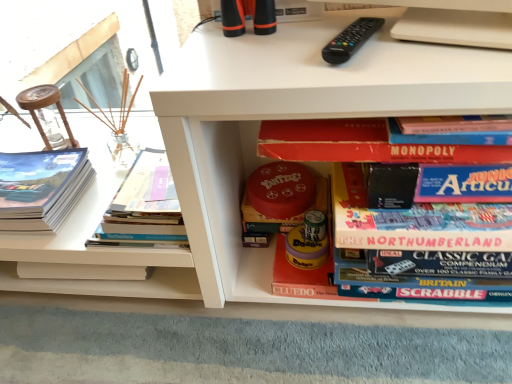
Question: From a real-world perspective, is red matte board game at center, the 4th book viewed from the left, over matte paper book at left, positioned as the 1th book in left-to-right order?

Choices:
 (A) no
 (B) yes

Answer: (B)

Question: Is red matte board game at center, which is counted as the first book, starting from the right, positioned far away from matte paper book at left, which ranks as the fourth book in right-to-left order?

Choices:
 (A) no
 (B) yes

Answer: (A)

Question: Is red matte board game at center, which is counted as the first book, starting from the right, positioned with its back to matte paper book at left, positioned as the 1th book in left-to-right order?

Choices:
 (A) no
 (B) yes

Answer: (A)

Question: Is red matte board game at center, the 4th book viewed from the left, taller than matte paper book at left, positioned as the 1th book in left-to-right order?

Choices:
 (A) yes
 (B) no

Answer: (A)

Question: Can you confirm if red matte board game at center, which is counted as the first book, starting from the right, is wider than matte paper book at left, which ranks as the fourth book in right-to-left order?

Choices:
 (A) no
 (B) yes

Answer: (B)

Question: Considering the positions of point (81, 173) and point (147, 163), is point (81, 173) closer or farther from the camera than point (147, 163)?

Choices:
 (A) closer
 (B) farther

Answer: (B)

Question: From a real-world perspective, is matte paper book at left, positioned as the 1th book in left-to-right order, above or below hardcover book at left, the 3th book in the right-to-left sequence?

Choices:
 (A) above
 (B) below

Answer: (B)

Question: From the image's perspective, relative to hardcover book at left, which appears as the second book when viewed from the left, is matte paper book at left, which ranks as the fourth book in right-to-left order, above or below?

Choices:
 (A) below
 (B) above

Answer: (A)

Question: Considering their positions, is matte paper book at left, which ranks as the fourth book in right-to-left order, located in front of or behind hardcover book at left, which appears as the second book when viewed from the left?

Choices:
 (A) front
 (B) behind

Answer: (B)

Question: Relative to red matte yahtzee board game at center, acting as the 2th book starting from the right, is red matte board game at center, which is counted as the first book, starting from the right, in front or behind?

Choices:
 (A) front
 (B) behind

Answer: (A)

Question: Visually, is red matte board game at center, the 4th book viewed from the left, positioned to the left or to the right of red matte yahtzee board game at center, acting as the 2th book starting from the right?

Choices:
 (A) left
 (B) right

Answer: (B)

Question: In terms of size, does red matte board game at center, the 4th book viewed from the left, appear bigger or smaller than red matte yahtzee board game at center, the third book from the left?

Choices:
 (A) big
 (B) small

Answer: (A)

Question: Is red matte board game at center, the 4th book viewed from the left, situated inside red matte yahtzee board game at center, acting as the 2th book starting from the right, or outside?

Choices:
 (A) outside
 (B) inside

Answer: (A)

Question: In terms of size, does black plastic remote at upper center appear bigger or smaller than hardcover book at left, the 3th book in the right-to-left sequence?

Choices:
 (A) big
 (B) small

Answer: (B)

Question: Relative to hardcover book at left, which appears as the second book when viewed from the left, is black plastic remote at upper center in front or behind?

Choices:
 (A) behind
 (B) front

Answer: (B)